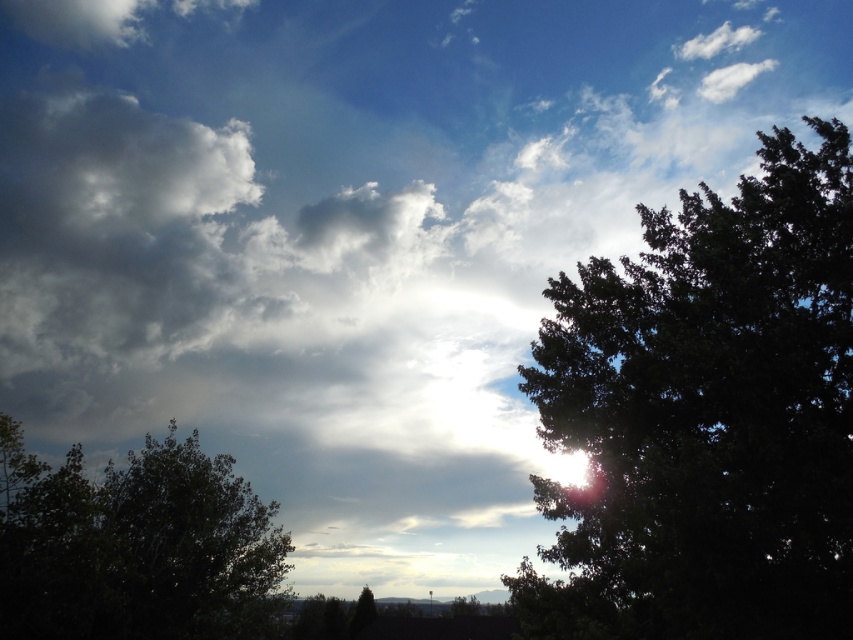
Question: Is green leafy tree at right above dark green leafy tree at lower left?

Choices:
 (A) no
 (B) yes

Answer: (B)

Question: Is green leafy tree at right to the right of dark green leafy tree at lower left from the viewer's perspective?

Choices:
 (A) yes
 (B) no

Answer: (A)

Question: Can you confirm if green leafy tree at right is positioned to the left of dark green leafy tree at lower left?

Choices:
 (A) no
 (B) yes

Answer: (A)

Question: Among these points, which one is nearest to the camera?

Choices:
 (A) (784, 316)
 (B) (39, 547)

Answer: (A)